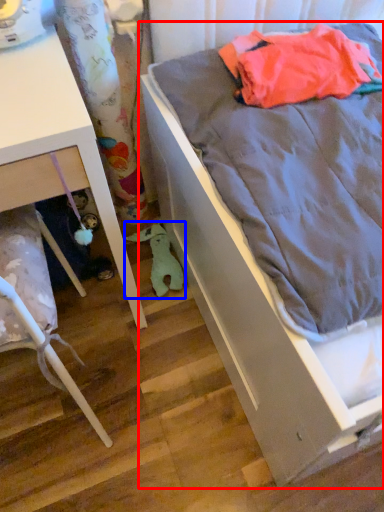
Question: Which object is further to the camera taking this photo, bed (highlighted by a red box) or stuff (highlighted by a blue box)?

Choices:
 (A) bed
 (B) stuff

Answer: (B)